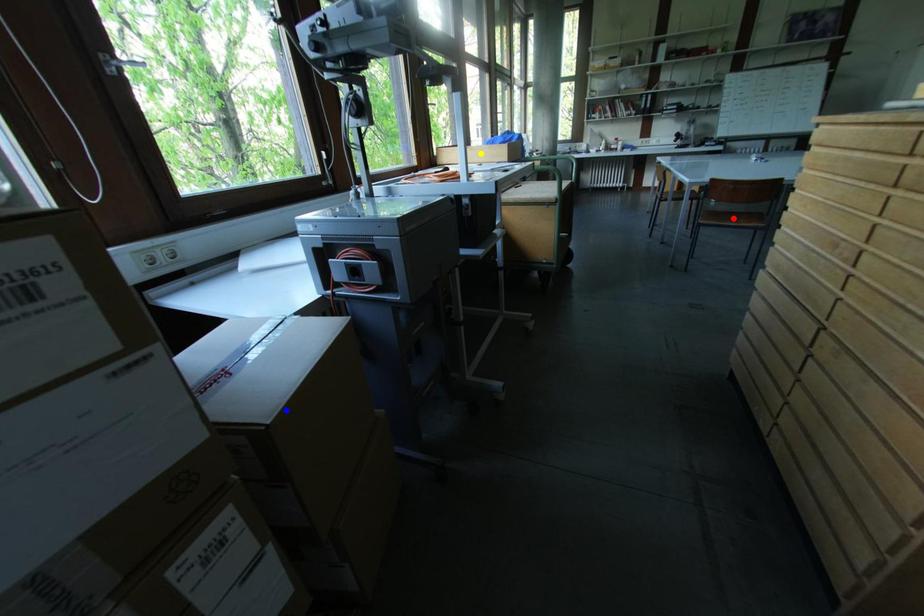
Order these from farthest to nearest:
yellow point
blue point
red point

red point → yellow point → blue point